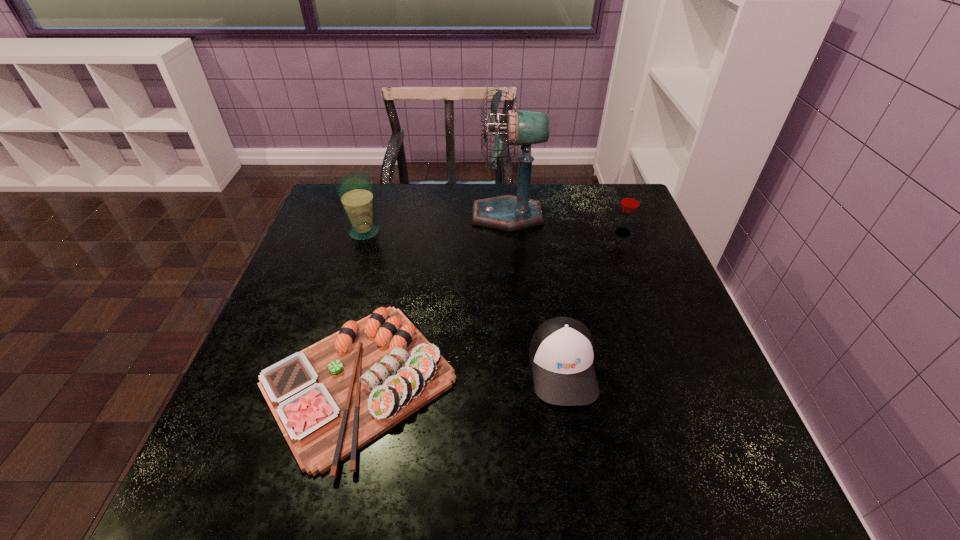
Where is `free point between the shortest object and the fan`? free point between the shortest object and the fan is located at coordinates (433, 299).

At what (x,y) coordinates should I click in order to perform the action: click on vacant area that lies between the tallest object and the cap. Please return your answer as a coordinate pair (x, y). The width and height of the screenshot is (960, 540). Looking at the image, I should click on tap(535, 291).

Locate an element on the screen. free space between the shorter glass and the tallest object is located at coordinates (564, 224).

The image size is (960, 540). I want to click on unoccupied position between the third shortest object and the tallest object, so click(x=564, y=224).

Identify the location of free space between the fourth tallest object and the shorter glass. (592, 300).

Where is `free spot between the fourth tallest object and the platter`? The width and height of the screenshot is (960, 540). free spot between the fourth tallest object and the platter is located at coordinates (461, 374).

The width and height of the screenshot is (960, 540). Identify the location of blank region between the left glass and the fourth tallest object. (464, 300).

You are a GUI agent. You are given a task and a screenshot of the screen. Output one action in this format:
    pyautogui.click(x=<x>, y=<y>)
    Task: Click on the vacant area between the rightmost object and the tallest object
    
    Given the screenshot: What is the action you would take?
    pyautogui.click(x=564, y=224)

I want to click on free space between the shorter glass and the platter, so click(491, 307).

Where is `object that stands as the third closest to the left glass`? The height and width of the screenshot is (540, 960). object that stands as the third closest to the left glass is located at coordinates (562, 349).